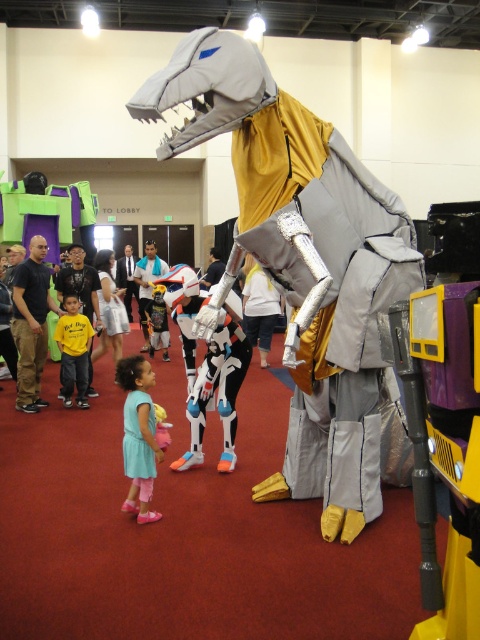
Who is lower down, light blue fabric dress at center or plush yellow costume at center?

light blue fabric dress at center is lower down.

Between point (124, 369) and point (140, 273), which one is positioned behind?

The point (140, 273) is more distant.

You are a GUI agent. You are given a task and a screenshot of the screen. Output one action in this format:
    pyautogui.click(x=<x>, y=<y>)
    Task: Click on the light blue fabric dress at center
    The image size is (480, 640).
    Given the screenshot: What is the action you would take?
    pyautogui.click(x=139, y=435)

Locate an element on the screen. light blue fabric dress at center is located at coordinates (139, 435).

Is point (144, 362) less distant than point (260, 294)?

Yes, point (144, 362) is closer to viewer.

Is light blue fabric dress at center smaller than white matte shirt at center?

Yes, light blue fabric dress at center is smaller than white matte shirt at center.

Which is behind, point (132, 380) or point (254, 314)?

The point (254, 314) is more distant.

This screenshot has height=640, width=480. In order to click on light blue fabric dress at center in this screenshot , I will do `click(139, 435)`.

Can you confirm if white and black costume at center is shorter than white matte costume at center?

No.

Between white and black costume at center and white matte costume at center, which one is positioned higher?

white and black costume at center is above.

Which is in front, point (132, 282) or point (204, 285)?

Point (204, 285)

At what (x,y) coordinates should I click in order to perform the action: click on white and black costume at center. Please return your answer as a coordinate pair (x, y). The image size is (480, 640). Looking at the image, I should click on (127, 276).